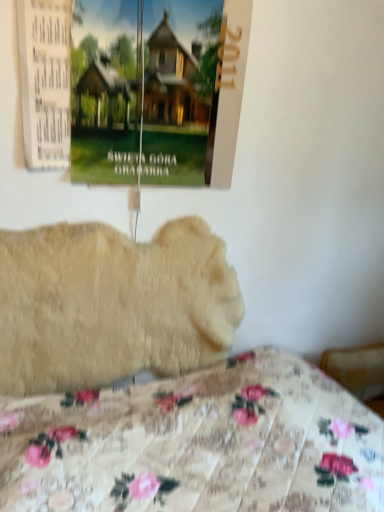
Where is `free location above fluffy beige dog at center (from a real-world perspective)`? The image size is (384, 512). free location above fluffy beige dog at center (from a real-world perspective) is located at coordinates (124, 210).